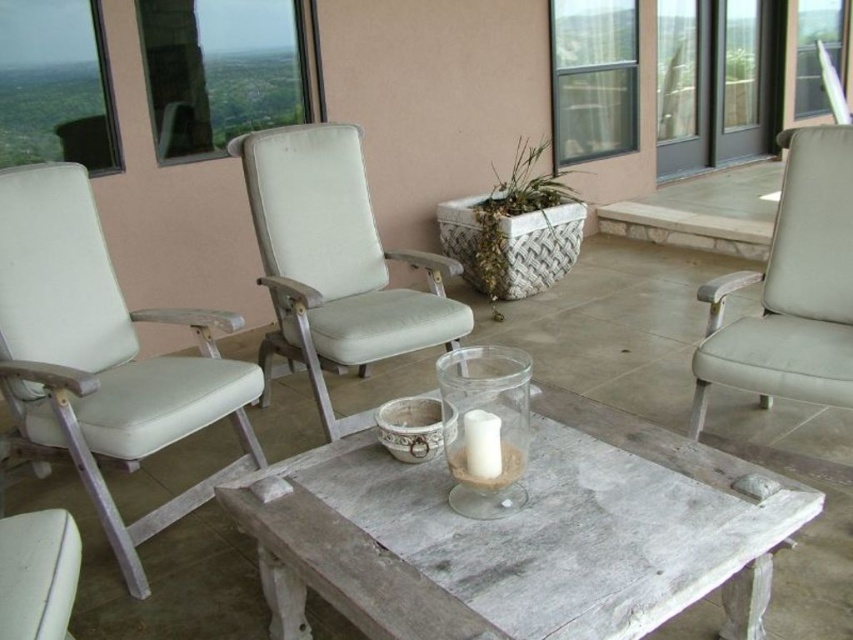
Question: Which of the following is the farthest from the observer?

Choices:
 (A) white fabric armchair at center
 (B) light beige fabric armchair at right
 (C) white distressed wood table at center

Answer: (A)

Question: Can you confirm if white leather armchair at left is smaller than white fabric armchair at center?

Choices:
 (A) yes
 (B) no

Answer: (A)

Question: Can you confirm if white leather armchair at left is thinner than light beige fabric armchair at right?

Choices:
 (A) no
 (B) yes

Answer: (A)

Question: Which of the following is the farthest from the observer?

Choices:
 (A) white leather armchair at left
 (B) white fabric armchair at center

Answer: (B)

Question: Is white fabric armchair at center below light beige fabric armchair at right?

Choices:
 (A) yes
 (B) no

Answer: (B)

Question: Which object appears farthest from the camera in this image?

Choices:
 (A) white leather armchair at left
 (B) white fabric armchair at center
 (C) white distressed wood table at center

Answer: (B)